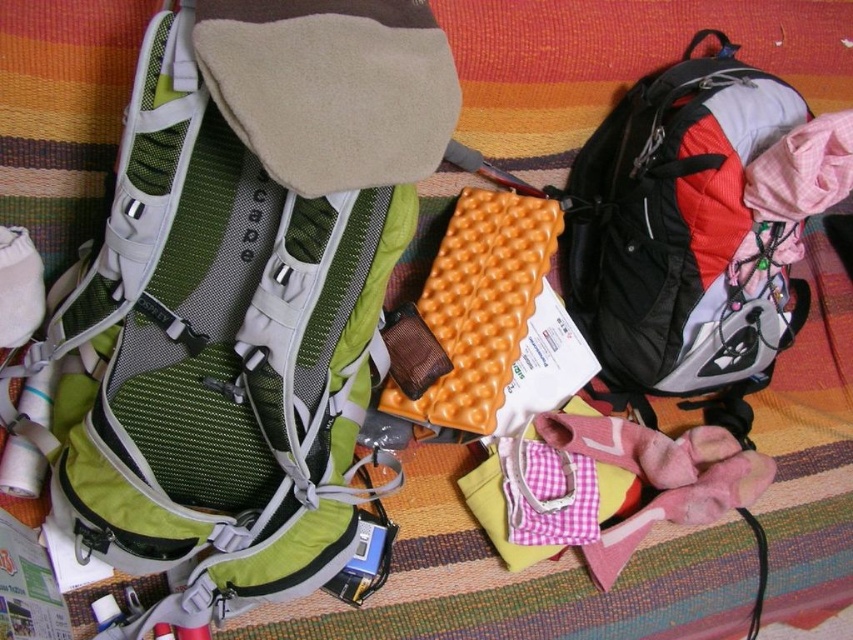
Can you confirm if green mesh backpack at upper left is bigger than matte black backpack at right?

Correct, green mesh backpack at upper left is larger in size than matte black backpack at right.

Is point (314, 445) behind point (596, 269)?

No, it is not.

Between point (312, 252) and point (659, 321), which one is positioned in front?

Positioned in front is point (312, 252).

I want to click on green mesh backpack at upper left, so click(x=216, y=356).